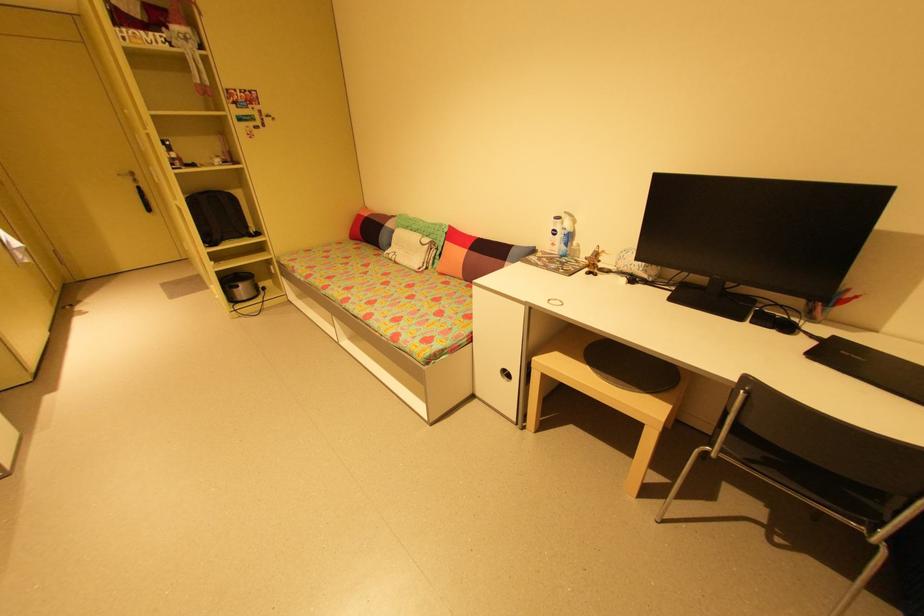
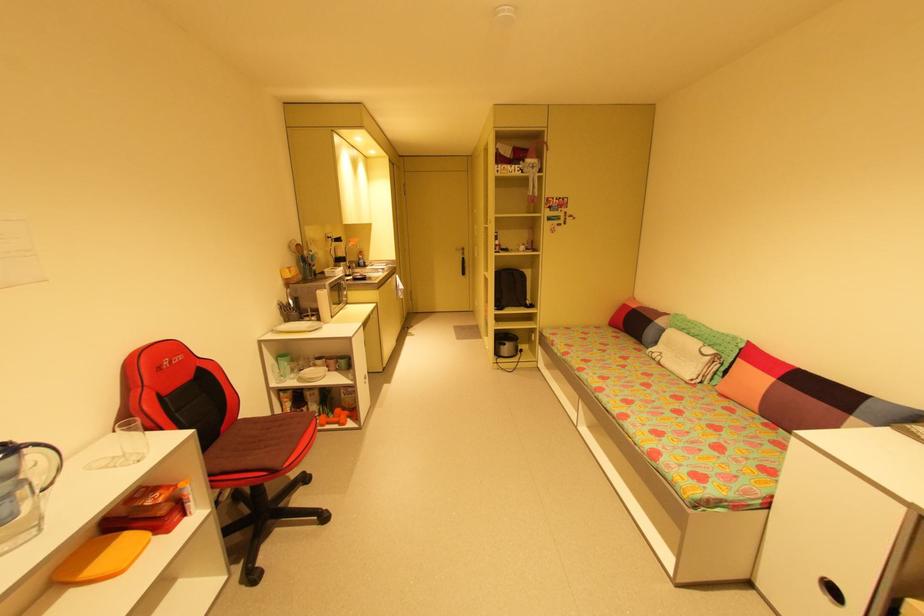
Question: The images are taken continuously from a first-person perspective. In which direction is your viewpoint rotating?

Choices:
 (A) Left
 (B) Right
 (C) Up
 (D) Down

Answer: (A)